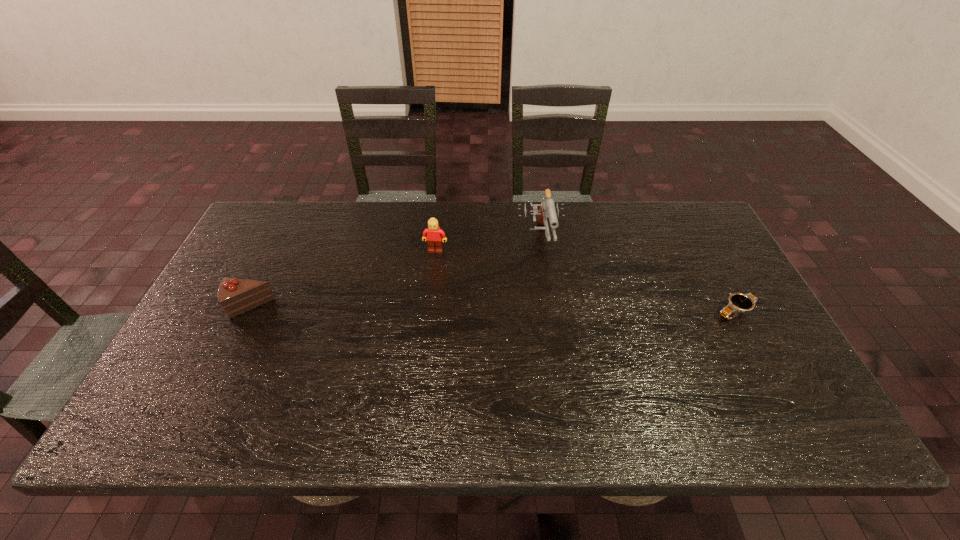
I want to click on free space on the desktop that is between the chocolate cake and the shortest object and is positioned on the face of the third object from right to left, so click(x=421, y=309).

The height and width of the screenshot is (540, 960). What are the coordinates of `free space on the desktop that is between the second shortest object and the rightmost object and is positioned at the barrel end of the tallest object` in the screenshot? It's located at (550, 310).